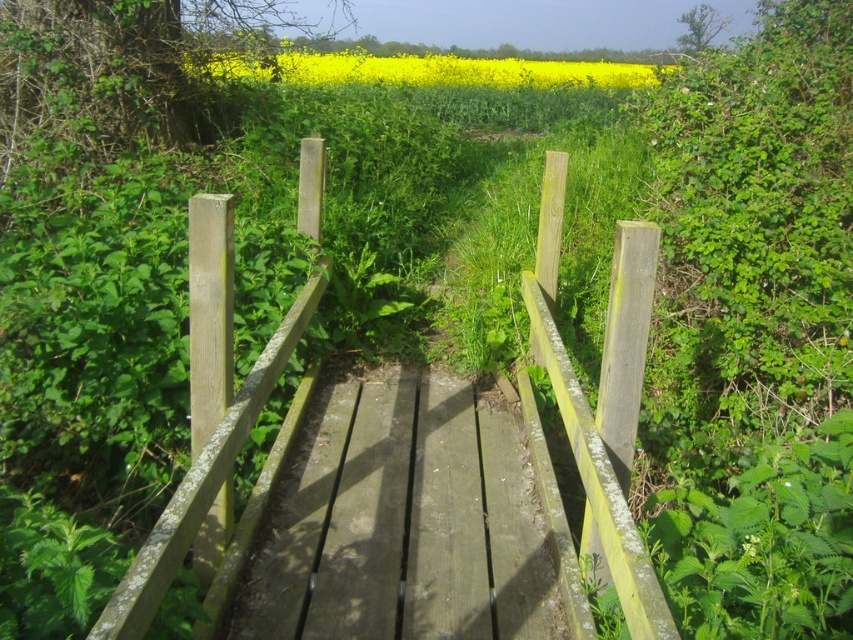
You are a painter who wants to paint the weathered wood rail at center and the smooth wooden path at center. Which object requires more paint because it has a larger surface area?

The weathered wood rail at center requires more paint because it is bigger than the smooth wooden path at center.